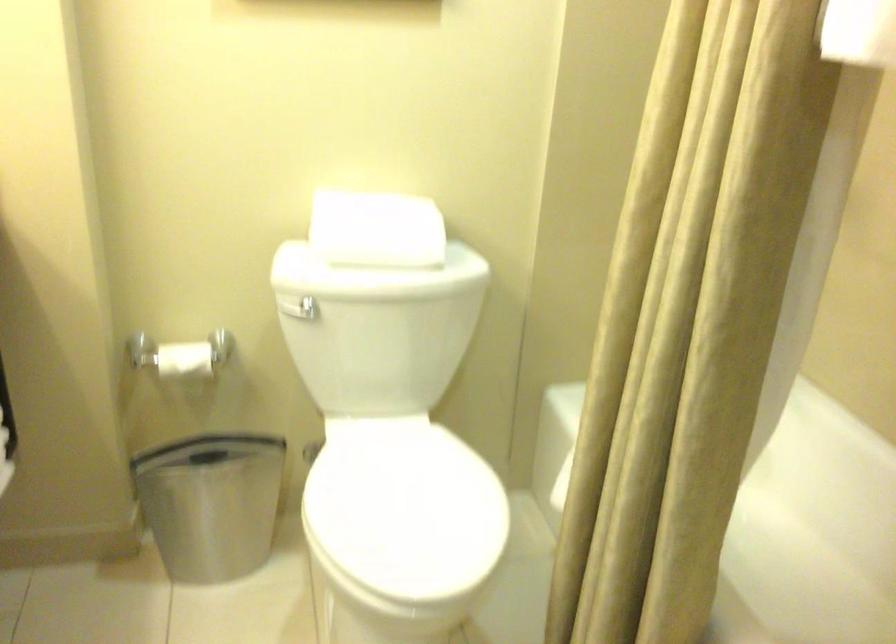
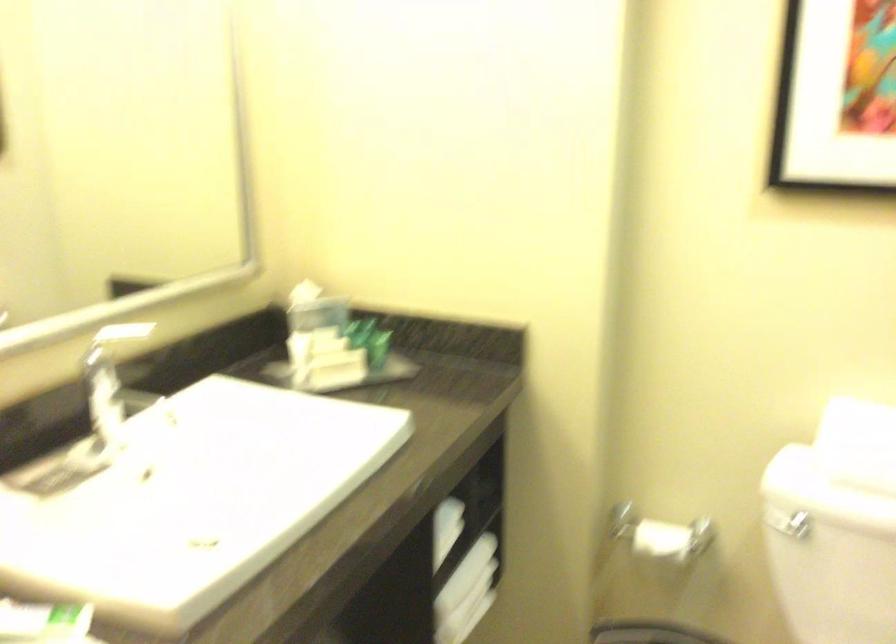
Question: The camera is either moving clockwise (left) or counter-clockwise (right) around the object. The first image is from the beginning of the video and the second image is from the end. Is the camera moving left or right when shooting the video?

Choices:
 (A) Left
 (B) Right

Answer: (B)